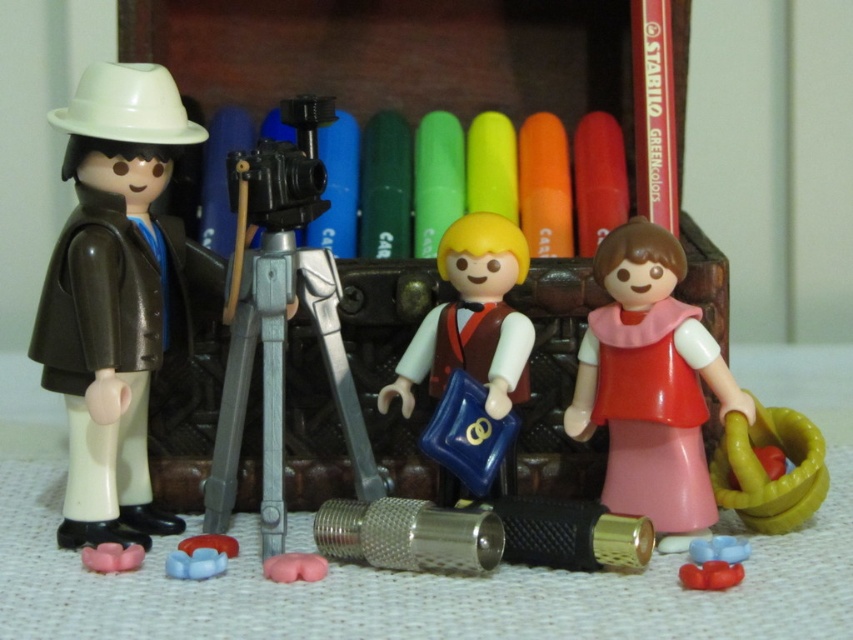
Is white matte vest at center taller than rubber yellow hoop at right?

Yes, white matte vest at center is taller than rubber yellow hoop at right.

Can you confirm if white matte vest at center is positioned to the right of rubber yellow hoop at right?

Incorrect, white matte vest at center is not on the right side of rubber yellow hoop at right.

At what (x,y) coordinates should I click in order to perform the action: click on white matte vest at center. Please return your answer as a coordinate pair (x, y). Looking at the image, I should click on (473, 320).

Does matte brown coat at left have a greater width compared to rubber yellow hoop at right?

Correct, the width of matte brown coat at left exceeds that of rubber yellow hoop at right.

Is matte brown coat at left above rubber yellow hoop at right?

Correct, matte brown coat at left is located above rubber yellow hoop at right.

I want to click on matte brown coat at left, so click(113, 294).

Consider the image. Who is higher up, white matte vest at center or orange matte crayon at center?

Positioned higher is orange matte crayon at center.

Is white matte vest at center to the right of orange matte crayon at center from the viewer's perspective?

No, white matte vest at center is not to the right of orange matte crayon at center.

Between point (440, 275) and point (547, 189), which one is positioned behind?

The point (547, 189) is behind.

Identify the location of white matte vest at center. Image resolution: width=853 pixels, height=640 pixels. (473, 320).